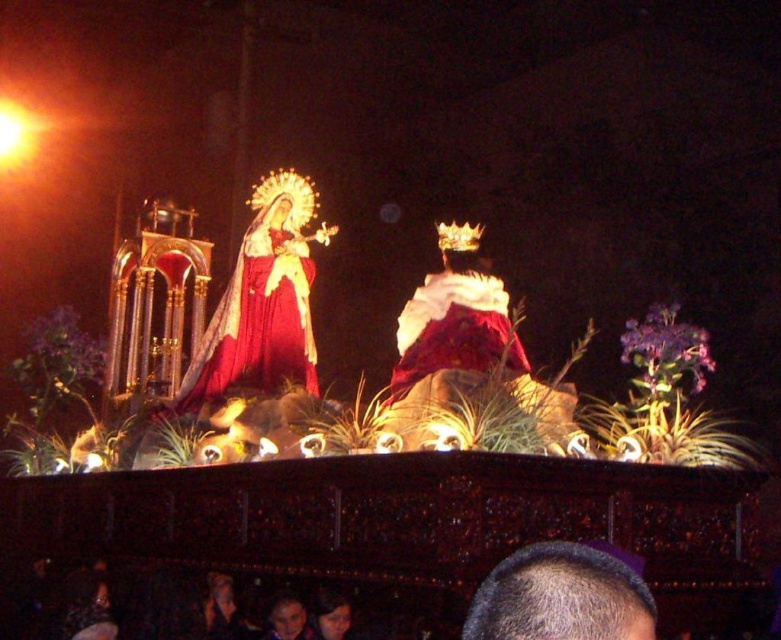
Question: Which point is closer to the camera?

Choices:
 (A) white velvet robe at center
 (B) matte gold statue at upper left

Answer: (A)

Question: Estimate the real-world distances between objects in this image. Which object is farther from the matte gold statue at upper left?

Choices:
 (A) white velvet robe at center
 (B) gray hair at upper center

Answer: (B)

Question: Does matte gold statue at upper left appear over white velvet robe at center?

Choices:
 (A) yes
 (B) no

Answer: (A)

Question: Where is gray hair at upper center located in relation to white velvet robe at center in the image?

Choices:
 (A) below
 (B) above

Answer: (A)

Question: Estimate the real-world distances between objects in this image. Which object is closer to the white velvet robe at center?

Choices:
 (A) gray hair at upper center
 (B) matte gold statue at upper left

Answer: (B)

Question: Is matte gold statue at upper left positioned before white velvet robe at center?

Choices:
 (A) no
 (B) yes

Answer: (A)